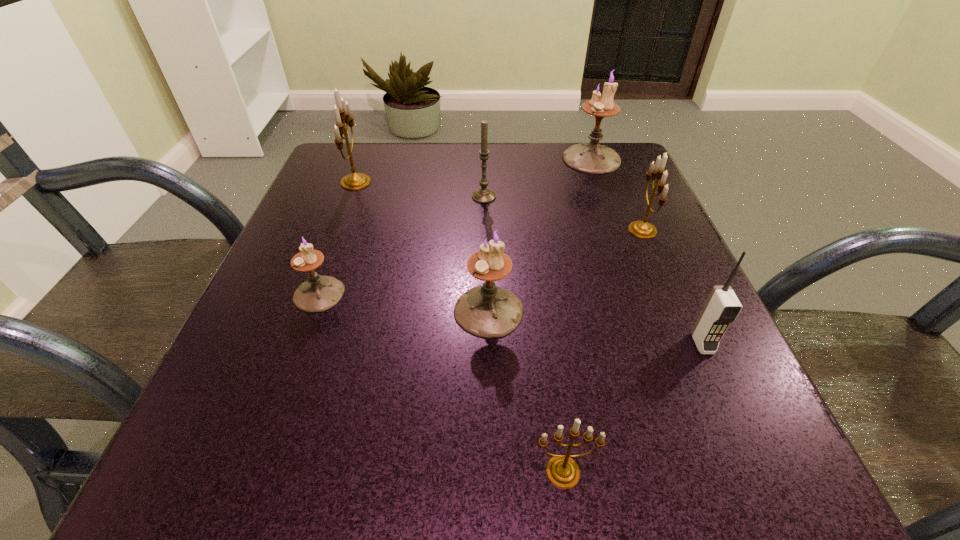
Locate an element on the screen. The width and height of the screenshot is (960, 540). the second gold candelabrum from right to left is located at coordinates (562, 471).

This screenshot has width=960, height=540. I want to click on the nearest object, so click(x=562, y=471).

You are a GUI agent. You are given a task and a screenshot of the screen. Output one action in this format:
    pyautogui.click(x=<x>, y=<y>)
    Task: Click on the free region located on the left of the biggest purple candle holder
    
    Given the screenshot: What is the action you would take?
    [x=434, y=159]

The height and width of the screenshot is (540, 960). I want to click on free spot located on the front of the farthest gold candelabrum, so (300, 332).

This screenshot has height=540, width=960. Identify the location of free location located on the right of the gray candle. (570, 197).

At what (x,y) coordinates should I click in order to perform the action: click on free region located on the front-facing side of the cellular telephone. Please return your answer as a coordinate pair (x, y). Image resolution: width=960 pixels, height=540 pixels. Looking at the image, I should click on (756, 463).

Image resolution: width=960 pixels, height=540 pixels. I want to click on free space located on the left of the second purple candle holder from right to left, so click(361, 310).

Where is `free space located on the back of the third farthest candelabrum`? free space located on the back of the third farthest candelabrum is located at coordinates (631, 201).

Find the location of `free location located 0.120m on the front of the leftmost purple candle holder`. free location located 0.120m on the front of the leftmost purple candle holder is located at coordinates (289, 376).

Find the location of a particular element. Image resolution: width=960 pixels, height=540 pixels. free space located on the back of the nearest gold candelabrum is located at coordinates (548, 361).